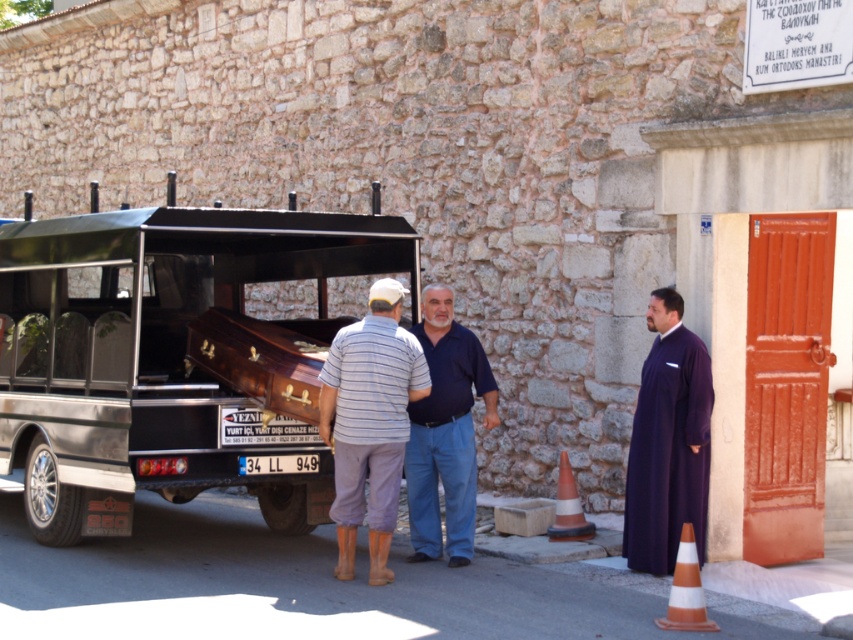
You are a photographer trying to capture the striped cotton shirt at center and the purple matte robe at right. Since the hearse and the red door are in the background, which clothing item should you focus on to ensure both are in focus?

The striped cotton shirt at center should be focused on because it is closer to the camera than the purple matte robe at right. Since the hearse and red door are in the background, focusing on the closer item will keep both foreground and background elements in focus.